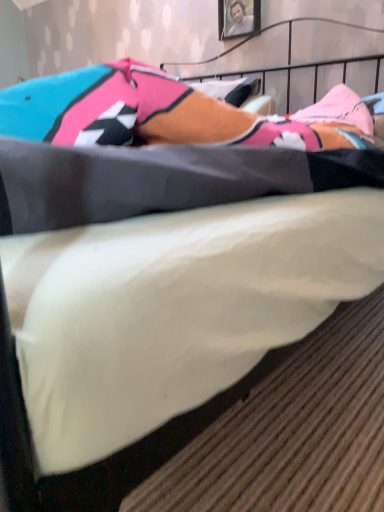
Find the location of a particular element. metallic silver picture frame at upper center is located at coordinates (238, 17).

What is the approximate height of metallic silver picture frame at upper center?

metallic silver picture frame at upper center is 11.43 inches tall.

The height and width of the screenshot is (512, 384). What do you see at coordinates (238, 17) in the screenshot?
I see `metallic silver picture frame at upper center` at bounding box center [238, 17].

Find the location of a particular element. metallic silver picture frame at upper center is located at coordinates (238, 17).